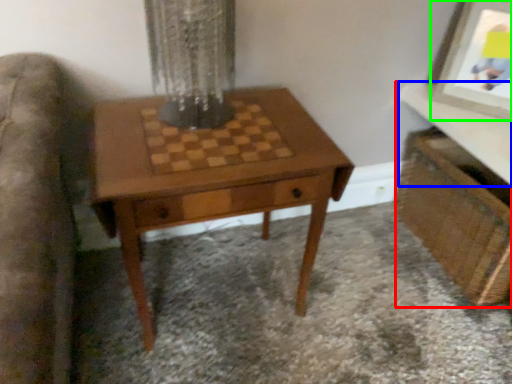
Question: Which object is the farthest from vanity (highlighted by a red box)? Choose among these: table top (highlighted by a blue box) or picture frame (highlighted by a green box).

Choices:
 (A) table top
 (B) picture frame

Answer: (B)